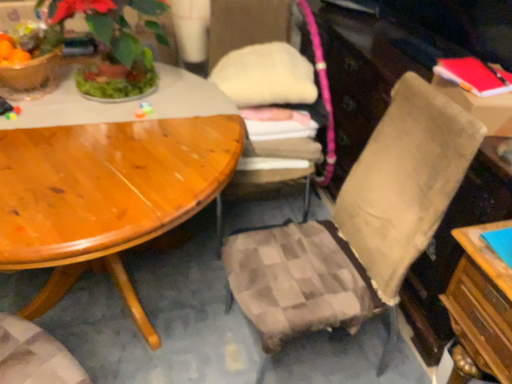
The width and height of the screenshot is (512, 384). What do you see at coordinates (246, 24) in the screenshot?
I see `plaid fabric chair at center, which ranks as the first chair in left-to-right order` at bounding box center [246, 24].

Image resolution: width=512 pixels, height=384 pixels. What are the coordinates of `green leafy plant at upper left` in the screenshot? It's located at (97, 49).

The height and width of the screenshot is (384, 512). What do you see at coordinates (31, 78) in the screenshot? I see `matte plastic flowerpot at upper left` at bounding box center [31, 78].

Find the location of a particular element. beige fabric chair at center, the first chair viewed from the right is located at coordinates (368, 216).

Where is `red matte book at upper right`? The width and height of the screenshot is (512, 384). red matte book at upper right is located at coordinates (474, 76).

Locate an element on the screen. This screenshot has height=384, width=512. plaid fabric chair at center, the 2th chair from the right is located at coordinates (246, 24).

Identify the location of book on the right of the matte plastic flowerpot at upper left. (474, 76).

From a real-world perspective, is red matte book at upper right physically located above or below matte plastic flowerpot at upper left?

Clearly, from a real-world perspective, red matte book at upper right is above matte plastic flowerpot at upper left.

In the scene shown: Can you tell me how much red matte book at upper right and matte plastic flowerpot at upper left differ in facing direction?

There is a 79.6-degree angle between the facing directions of red matte book at upper right and matte plastic flowerpot at upper left.

Based on their positions, is red matte book at upper right located to the left or right of matte plastic flowerpot at upper left?

From the image, it's evident that red matte book at upper right is to the right of matte plastic flowerpot at upper left.

Which is in front, point (271, 102) or point (375, 197)?

The point (375, 197) is more forward.

From a real-world perspective, is plaid fabric chair at center, which ranks as the first chair in left-to-right order, over beige fabric chair at center, the first chair viewed from the right?

Yes, from a real-world perspective, plaid fabric chair at center, which ranks as the first chair in left-to-right order, is above beige fabric chair at center, the first chair viewed from the right.

Considering the relative sizes of plaid fabric chair at center, which ranks as the first chair in left-to-right order, and beige fabric chair at center, the first chair viewed from the right, in the image provided, is plaid fabric chair at center, which ranks as the first chair in left-to-right order, bigger than beige fabric chair at center, the first chair viewed from the right,?

No, plaid fabric chair at center, which ranks as the first chair in left-to-right order, is not bigger than beige fabric chair at center, the first chair viewed from the right.

Can you confirm if plaid fabric chair at center, the 2th chair from the right, is positioned to the left of beige fabric chair at center, acting as the second chair starting from the left?

Yes, plaid fabric chair at center, the 2th chair from the right, is to the left of beige fabric chair at center, acting as the second chair starting from the left.

Which is in front, beige fabric chair at center, the first chair viewed from the right, or matte plastic flowerpot at upper left?

beige fabric chair at center, the first chair viewed from the right, is in front.

Does beige fabric chair at center, the first chair viewed from the right, have a greater height compared to matte plastic flowerpot at upper left?

Yes.

From the image's perspective, who appears lower, beige fabric chair at center, the first chair viewed from the right, or matte plastic flowerpot at upper left?

From the image's view, beige fabric chair at center, the first chair viewed from the right, is below.

Which point is more distant from viewer, (53, 74) or (108, 37)?

The point (53, 74) is farther from the camera.

Is matte plastic flowerpot at upper left inside or outside of green leafy plant at upper left?

matte plastic flowerpot at upper left is not enclosed by green leafy plant at upper left.

Between matte plastic flowerpot at upper left and green leafy plant at upper left, which one has less height?

Standing shorter between the two is matte plastic flowerpot at upper left.

From the picture: Does matte plastic flowerpot at upper left have a smaller size compared to green leafy plant at upper left?

Yes, matte plastic flowerpot at upper left is smaller than green leafy plant at upper left.

Based on the photo, which is in front, green leafy plant at upper left or red matte book at upper right?

green leafy plant at upper left.

Which is further, (76, 5) or (456, 63)?

The point (456, 63) is more distant.

Considering the sizes of green leafy plant at upper left and red matte book at upper right in the image, is green leafy plant at upper left wider or thinner than red matte book at upper right?

Clearly, green leafy plant at upper left has more width compared to red matte book at upper right.

From the image's perspective, is green leafy plant at upper left above or below red matte book at upper right?

Clearly, from the image's perspective, green leafy plant at upper left is above red matte book at upper right.

How many degrees apart are the facing directions of plaid fabric chair at center, which ranks as the first chair in left-to-right order, and matte plastic flowerpot at upper left?

7.25 degrees separate the facing orientations of plaid fabric chair at center, which ranks as the first chair in left-to-right order, and matte plastic flowerpot at upper left.

From a real-world perspective, which object rests below the other?

In real-world perspective, plaid fabric chair at center, which ranks as the first chair in left-to-right order, is lower.

In terms of size, does plaid fabric chair at center, which ranks as the first chair in left-to-right order, appear bigger or smaller than matte plastic flowerpot at upper left?

In the image, plaid fabric chair at center, which ranks as the first chair in left-to-right order, appears to be larger than matte plastic flowerpot at upper left.

Find the location of a particular element. The width and height of the screenshot is (512, 384). flowerpot located on the left of plaid fabric chair at center, which ranks as the first chair in left-to-right order is located at coordinates (31, 78).

Based on the photo, from the image's perspective, is red matte book at upper right positioned above or below green leafy plant at upper left?

red matte book at upper right is situated lower than green leafy plant at upper left in the image.

Is red matte book at upper right in front of or behind green leafy plant at upper left in the image?

Clearly, red matte book at upper right is behind green leafy plant at upper left.

Considering the relative sizes of red matte book at upper right and green leafy plant at upper left in the image provided, is red matte book at upper right smaller than green leafy plant at upper left?

Yes, red matte book at upper right is smaller than green leafy plant at upper left.

Which is closer, (499, 123) or (49, 61)?

The point (499, 123) is in front.

Image resolution: width=512 pixels, height=384 pixels. Find the location of `flowerpot directly beneath the red matte book at upper right (from a real-world perspective)`. flowerpot directly beneath the red matte book at upper right (from a real-world perspective) is located at coordinates (31, 78).

At what (x,y) coordinates should I click in order to perform the action: click on chair that appears above the beige fabric chair at center, the first chair viewed from the right (from a real-world perspective). Please return your answer as a coordinate pair (x, y). Looking at the image, I should click on (246, 24).

Based on their spatial positions, is green leafy plant at upper left or beige fabric chair at center, the first chair viewed from the right, further from red matte book at upper right?

The object further to red matte book at upper right is green leafy plant at upper left.

When comparing their distances from matte plastic flowerpot at upper left, does red matte book at upper right or red matte book at upper right seem closer?

Among the two, red matte book at upper right is located nearer to matte plastic flowerpot at upper left.

Based on their spatial positions, is red matte book at upper right or plaid fabric chair at center, which ranks as the first chair in left-to-right order, further from red matte book at upper right?

plaid fabric chair at center, which ranks as the first chair in left-to-right order.

Estimate the real-world distances between objects in this image. Which object is closer to matte plastic flowerpot at upper left, green leafy plant at upper left or red matte book at upper right?

Among the two, green leafy plant at upper left is located nearer to matte plastic flowerpot at upper left.

When comparing their distances from plaid fabric chair at center, which ranks as the first chair in left-to-right order, does red matte book at upper right or beige fabric chair at center, acting as the second chair starting from the left, seem closer?

Based on the image, beige fabric chair at center, acting as the second chair starting from the left, appears to be nearer to plaid fabric chair at center, which ranks as the first chair in left-to-right order.

Considering their positions, is green leafy plant at upper left positioned further to red matte book at upper right than beige fabric chair at center, the first chair viewed from the right?

green leafy plant at upper left is positioned further to the anchor red matte book at upper right.

Which object lies further to the anchor point green leafy plant at upper left, red matte book at upper right or beige fabric chair at center, acting as the second chair starting from the left?

red matte book at upper right.

Considering their positions, is red matte book at upper right positioned closer to beige fabric chair at center, acting as the second chair starting from the left, than green leafy plant at upper left?

The object closer to beige fabric chair at center, acting as the second chair starting from the left, is red matte book at upper right.

Where is `book located between plaid fabric chair at center, which ranks as the first chair in left-to-right order, and red matte book at upper right in the left-right direction`? book located between plaid fabric chair at center, which ranks as the first chair in left-to-right order, and red matte book at upper right in the left-right direction is located at coordinates pyautogui.click(x=474, y=76).

Where is `houseplant situated between matte plastic flowerpot at upper left and red matte book at upper right from left to right`? This screenshot has height=384, width=512. houseplant situated between matte plastic flowerpot at upper left and red matte book at upper right from left to right is located at coordinates (97, 49).

What are the coordinates of `book between green leafy plant at upper left and red matte book at upper right in the horizontal direction` in the screenshot? It's located at (474, 76).

The width and height of the screenshot is (512, 384). What are the coordinates of `chair between matte plastic flowerpot at upper left and beige fabric chair at center, acting as the second chair starting from the left, in the horizontal direction` in the screenshot? It's located at (246, 24).